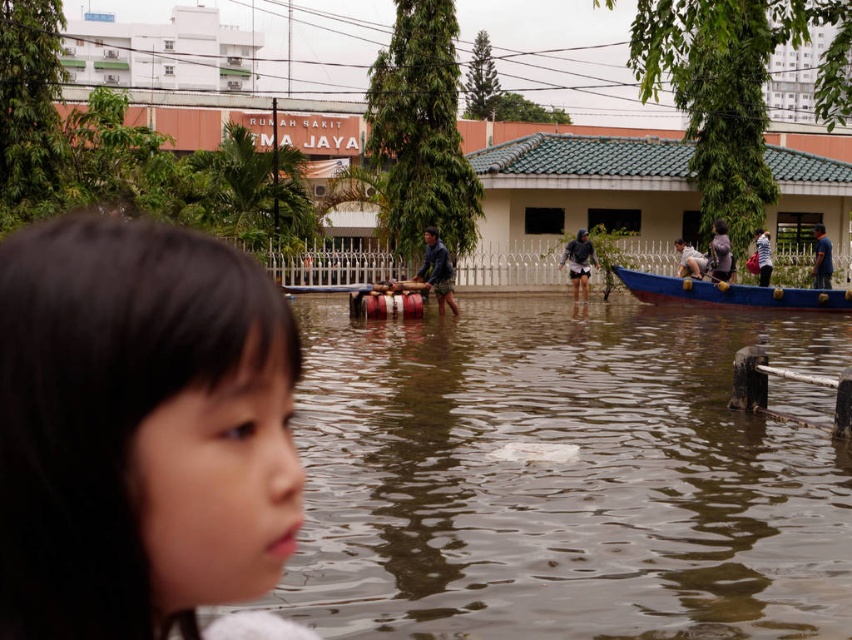
Question: Which object is farther from the camera taking this photo?

Choices:
 (A) blue wooden canoe at right
 (B) brown matte water at center
 (C) dark brown hair at lower left
 (D) wooden boat at center

Answer: (A)

Question: Which point is farther to the camera?

Choices:
 (A) (707, 289)
 (B) (493, 378)

Answer: (A)

Question: Is brown matte water at center above dark brown hair at lower left?

Choices:
 (A) no
 (B) yes

Answer: (A)

Question: Considering the relative positions of brown matte water at center and dark brown hair at lower left in the image provided, where is brown matte water at center located with respect to dark brown hair at lower left?

Choices:
 (A) above
 (B) below

Answer: (B)

Question: Is brown matte water at center wider than dark brown hair at lower left?

Choices:
 (A) yes
 (B) no

Answer: (A)

Question: Which of the following is the closest to the observer?

Choices:
 (A) click(232, 300)
 (B) click(331, 291)
 (C) click(447, 365)
 (D) click(721, 285)

Answer: (A)